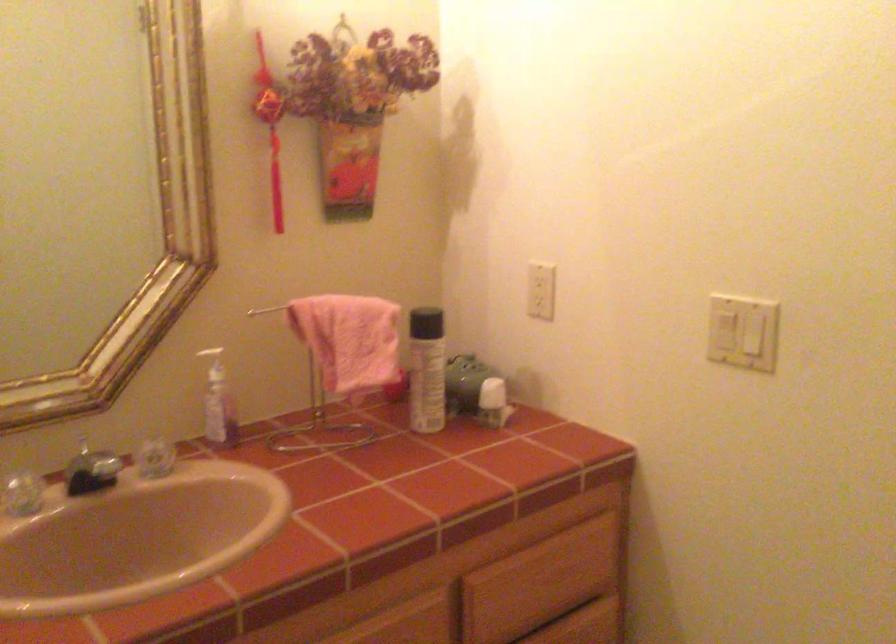
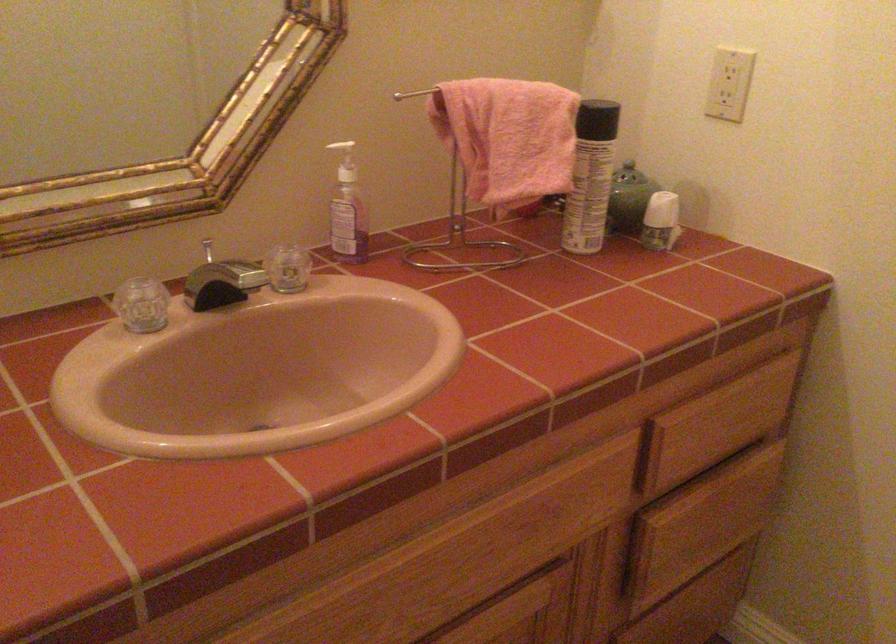
In the second image, find the point that corresponds to [214,406] in the first image.

(348, 210)